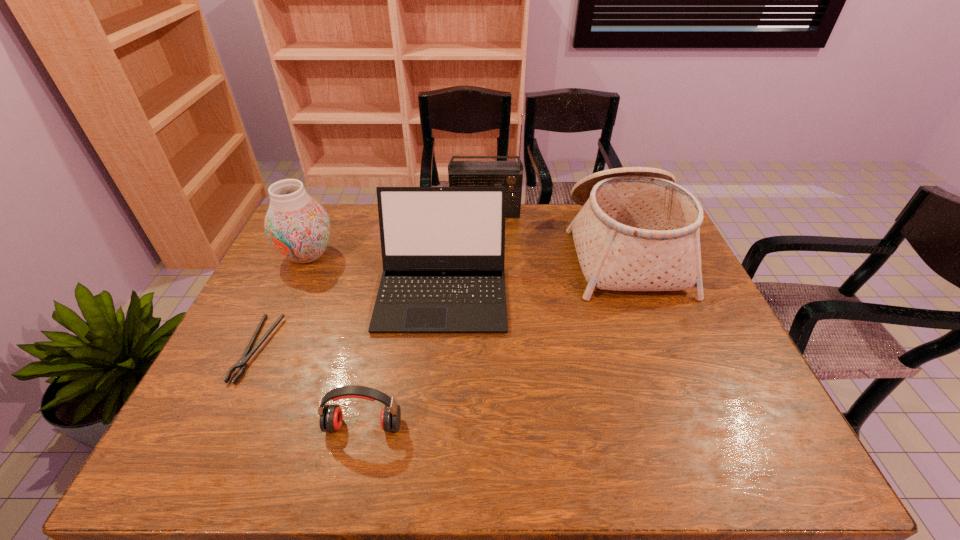
Where is `blank area located 0.230m with the lid open on the rightmost object`? The image size is (960, 540). blank area located 0.230m with the lid open on the rightmost object is located at coordinates (501, 249).

You are a GUI agent. You are given a task and a screenshot of the screen. Output one action in this format:
    pyautogui.click(x=<x>, y=<y>)
    Task: Click on the free space located on the surface of the laptop
    This screenshot has width=960, height=540.
    Given the screenshot: What is the action you would take?
    pyautogui.click(x=437, y=350)

Where is `vacant area situated 0.110m on the front of the vase`? vacant area situated 0.110m on the front of the vase is located at coordinates (x=288, y=299).

This screenshot has height=540, width=960. Identify the location of free space located 0.080m on the ear cups of the fifth tallest object. (353, 473).

Locate an element on the screen. This screenshot has width=960, height=540. free space located on the back of the shortest object is located at coordinates (311, 238).

You are a GUI agent. You are given a task and a screenshot of the screen. Output one action in this format:
    pyautogui.click(x=<x>, y=<y>)
    Task: Click on the radio receiver present at the far edge
    This screenshot has width=960, height=540.
    Given the screenshot: What is the action you would take?
    pyautogui.click(x=509, y=174)

Locate an element on the screen. basket present at the far edge is located at coordinates click(638, 230).

Image resolution: width=960 pixels, height=540 pixels. I want to click on vase that is at the far edge, so click(x=298, y=227).

In order to click on object that is at the near edge in this screenshot , I will do `click(331, 417)`.

Where is `vase present at the left edge`? vase present at the left edge is located at coordinates (298, 227).